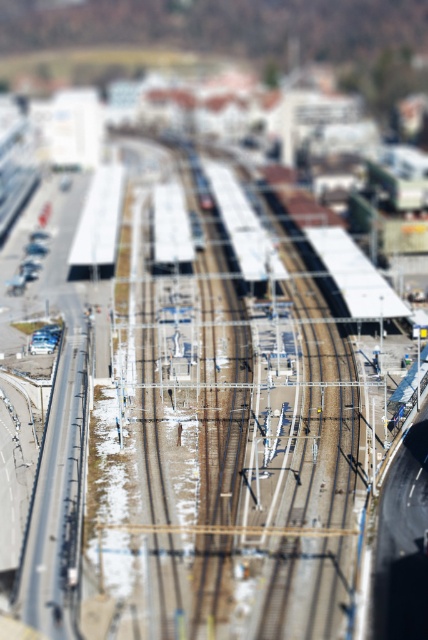
You are a photographer standing at the elevated position where the image was taken. You want to capture a closeup shot of the white metallic train at center and the white matte platform at left. Which object should you focus on first to ensure it appears larger in your photo?

The white metallic train at center is closer to the viewer than the white matte platform at left, so focusing on it first will make it appear larger in the photo.

You are a photographer planning to capture a wide shot of the white metallic train at center and the white matte platform at left. Given that the train is larger in size than the platform, how might this affect your composition?

The white metallic train at center is larger than the white matte platform at left, so to balance the composition, you could position the train centrally and place the platform off to one side to avoid overwhelming the frame.